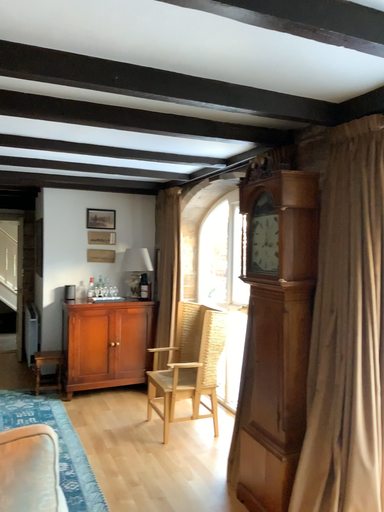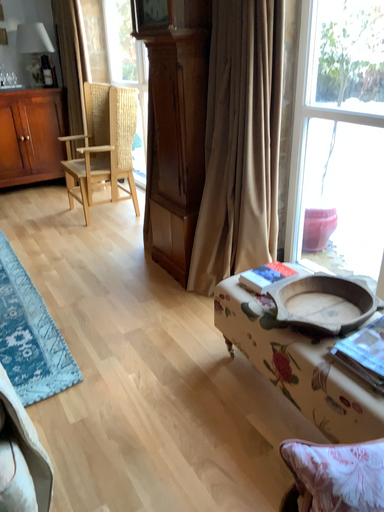
Question: Which way did the camera rotate in the video?

Choices:
 (A) rotated upward
 (B) rotated downward

Answer: (B)